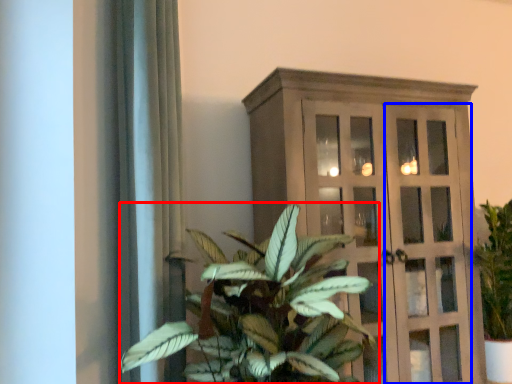
Question: Which point is closer to the camera, houseplant (highlighted by a red box) or screen door (highlighted by a blue box)?

Choices:
 (A) houseplant
 (B) screen door

Answer: (A)